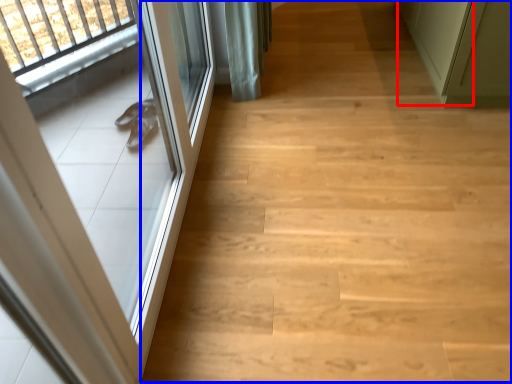
Question: Which of the following is the closest to the observer, door (highlighted by a red box) or stairwell (highlighted by a blue box)?

Choices:
 (A) door
 (B) stairwell

Answer: (B)